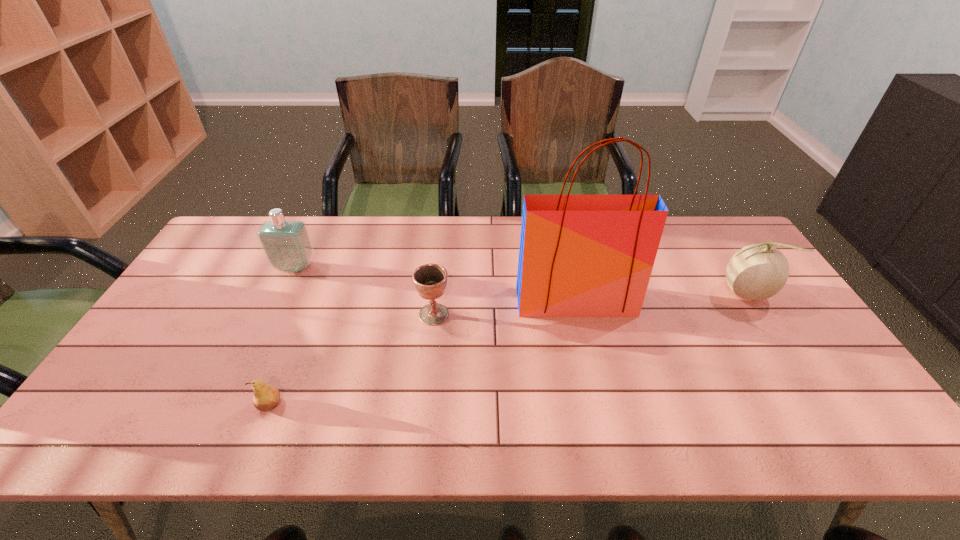
Where is `free space in the image that satisfies the following two spatial constraints: 1. on the front label of the perfume; 2. on the left side of the cantaloup`? This screenshot has width=960, height=540. free space in the image that satisfies the following two spatial constraints: 1. on the front label of the perfume; 2. on the left side of the cantaloup is located at coordinates (283, 293).

Locate an element on the screen. free space that satisfies the following two spatial constraints: 1. on the front label of the third object from right to left; 2. on the left side of the farthest object is located at coordinates (273, 314).

What are the coordinates of `blank space that satisfies the following two spatial constraints: 1. on the front label of the farthest object; 2. on the left side of the fourth object from right to left` in the screenshot? It's located at (229, 406).

At what (x,y) coordinates should I click in order to perform the action: click on free point that satisfies the following two spatial constraints: 1. on the back side of the rightmost object; 2. on the right side of the second shortest object. Please return your answer as a coordinate pair (x, y). Looking at the image, I should click on [436, 293].

The height and width of the screenshot is (540, 960). Find the location of `vacant space that satisfies the following two spatial constraints: 1. on the front label of the pear; 2. on the left side of the perfume`. vacant space that satisfies the following two spatial constraints: 1. on the front label of the pear; 2. on the left side of the perfume is located at coordinates (229, 406).